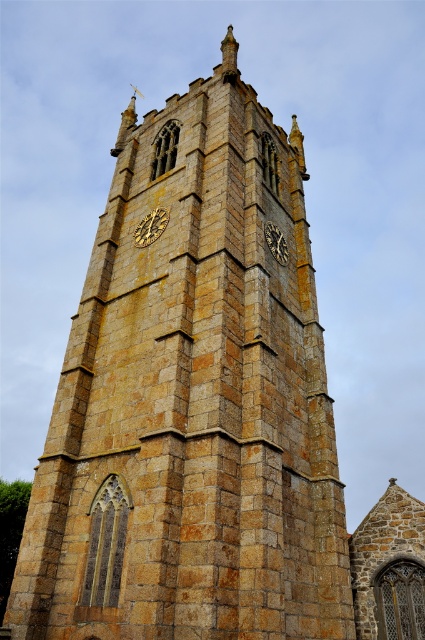
This screenshot has width=425, height=640. What do you see at coordinates (150, 227) in the screenshot?
I see `gold textured clock at center` at bounding box center [150, 227].

Does gold textured clock at center have a lesser height compared to golden stone clock at center?

Indeed, gold textured clock at center has a lesser height compared to golden stone clock at center.

This screenshot has height=640, width=425. What do you see at coordinates (150, 227) in the screenshot?
I see `gold textured clock at center` at bounding box center [150, 227].

The height and width of the screenshot is (640, 425). Find the location of `gold textured clock at center`. gold textured clock at center is located at coordinates (150, 227).